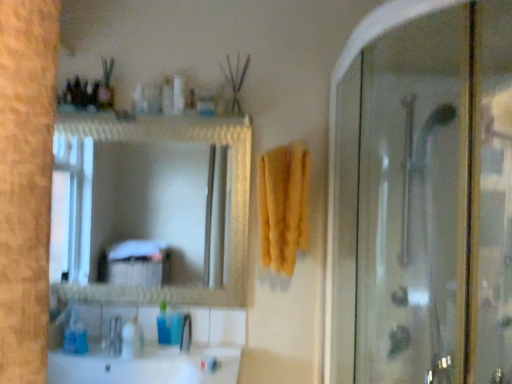
Question: Is blue plastic cup at lower center, the fourth toiletry in the top-to-bottom sequence, closer to camera compared to brushed metal faucet at lower center?

Choices:
 (A) yes
 (B) no

Answer: (B)

Question: Can you confirm if blue plastic cup at lower center, marked as the first toiletry in a bottom-to-top arrangement, is taller than brushed metal faucet at lower center?

Choices:
 (A) yes
 (B) no

Answer: (B)

Question: Does blue plastic cup at lower center, which is counted as the first toiletry, starting from the right, appear on the left side of brushed metal faucet at lower center?

Choices:
 (A) no
 (B) yes

Answer: (B)

Question: Is the depth of blue plastic cup at lower center, marked as the first toiletry in a bottom-to-top arrangement, greater than that of brushed metal faucet at lower center?

Choices:
 (A) yes
 (B) no

Answer: (A)

Question: Does blue plastic cup at lower center, the fourth toiletry in the top-to-bottom sequence, have a smaller size compared to brushed metal faucet at lower center?

Choices:
 (A) yes
 (B) no

Answer: (B)

Question: Is blue plastic cup at lower center, which is counted as the first toiletry, starting from the right, facing towards brushed metal faucet at lower center?

Choices:
 (A) yes
 (B) no

Answer: (B)

Question: Does white glossy sink at lower left appear on the left side of transparent glass shower door at right?

Choices:
 (A) yes
 (B) no

Answer: (A)

Question: Considering the relative sizes of white glossy sink at lower left and transparent glass shower door at right in the image provided, is white glossy sink at lower left thinner than transparent glass shower door at right?

Choices:
 (A) no
 (B) yes

Answer: (B)

Question: Does white glossy sink at lower left contain transparent glass shower door at right?

Choices:
 (A) yes
 (B) no

Answer: (B)

Question: Is white glossy sink at lower left taller than transparent glass shower door at right?

Choices:
 (A) yes
 (B) no

Answer: (B)

Question: Is white glossy sink at lower left positioned in front of transparent glass shower door at right?

Choices:
 (A) yes
 (B) no

Answer: (B)

Question: Would you say white glossy sink at lower left is outside transparent glass shower door at right?

Choices:
 (A) no
 (B) yes

Answer: (B)

Question: Is blue plastic bottle at lower center, the third toiletry from the bottom, thinner than yellow soft towel at center?

Choices:
 (A) no
 (B) yes

Answer: (B)